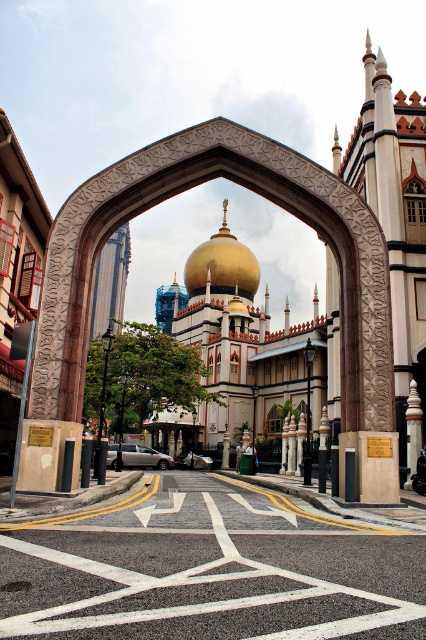
Does gold polished dome at center appear on the left side of green fabric person at center?

Correct, you'll find gold polished dome at center to the left of green fabric person at center.

Does gold polished dome at center have a smaller size compared to green fabric person at center?

No.

Between point (212, 275) and point (236, 464), which one is positioned in front?

Positioned in front is point (236, 464).

I want to click on gold polished dome at center, so coord(221,266).